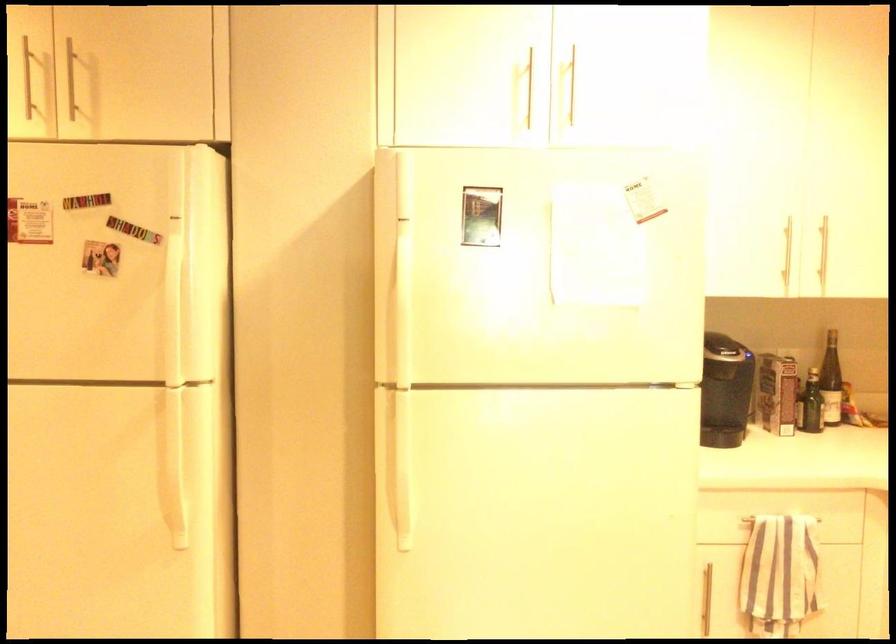
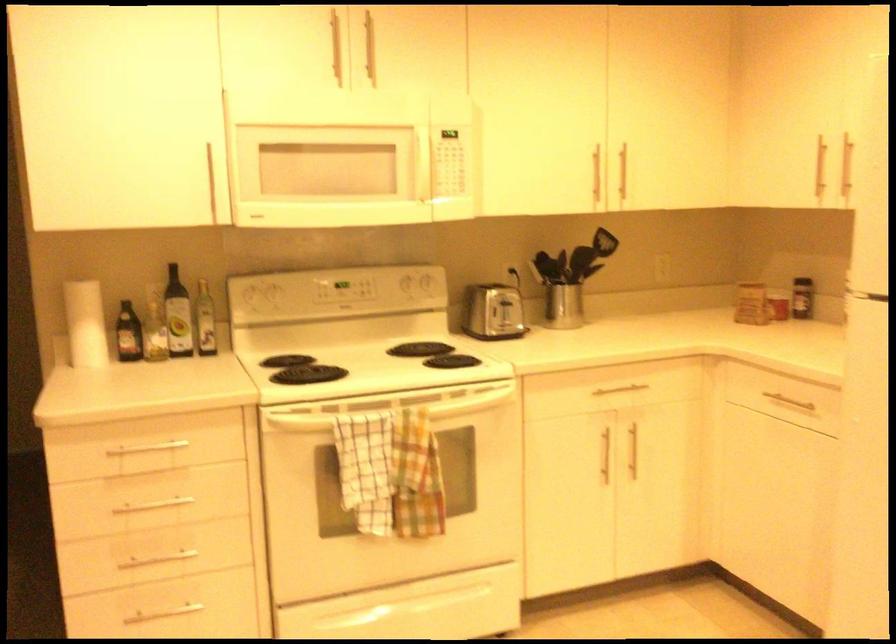
Question: How did the camera likely rotate?

Choices:
 (A) Left
 (B) Right
 (C) Up
 (D) Down

Answer: (A)